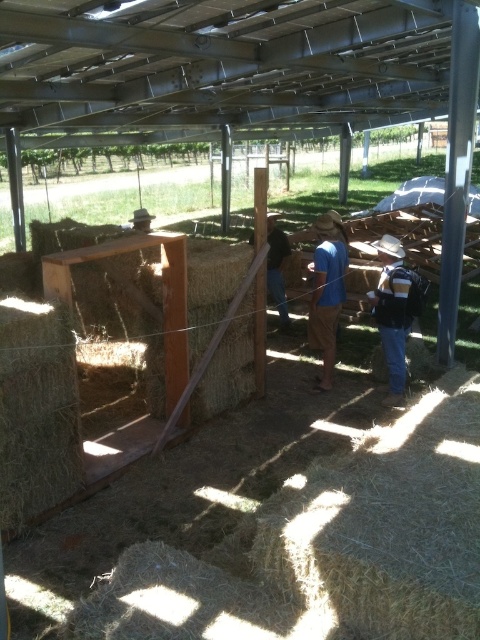
Question: Which of these objects is positioned farthest from the denim jacket at center?

Choices:
 (A) dark brown leather boots at center
 (B) blue cotton shirt at center

Answer: (A)

Question: Does denim jacket at center appear under blue cotton shirt at center?

Choices:
 (A) yes
 (B) no

Answer: (A)

Question: Which of the following is the closest to the observer?

Choices:
 (A) (402, 260)
 (B) (269, 250)
 (C) (342, 268)

Answer: (A)

Question: Is denim jacket at center bigger than blue cotton shirt at center?

Choices:
 (A) no
 (B) yes

Answer: (A)

Question: Which is nearer to the blue cotton shirt at center?

Choices:
 (A) denim jacket at center
 (B) dark brown leather boots at center

Answer: (A)

Question: Does blue cotton shirt at center appear on the left side of dark brown leather boots at center?

Choices:
 (A) no
 (B) yes

Answer: (A)